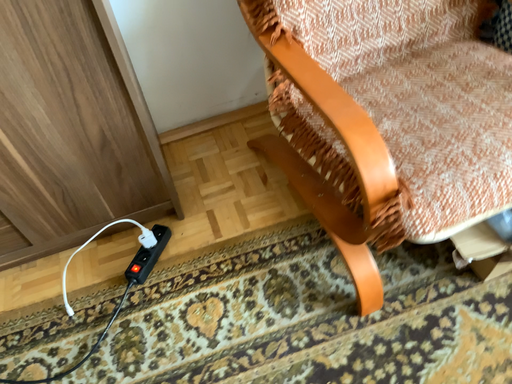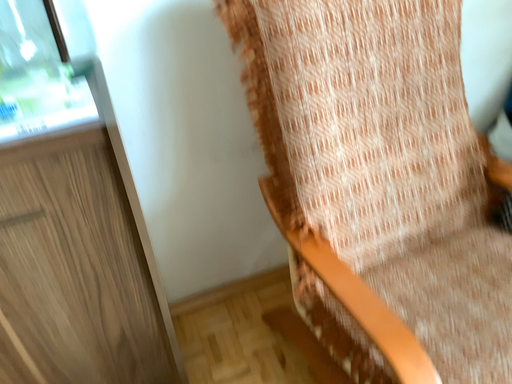
Question: Which way did the camera rotate in the video?

Choices:
 (A) rotated downward
 (B) rotated upward

Answer: (B)